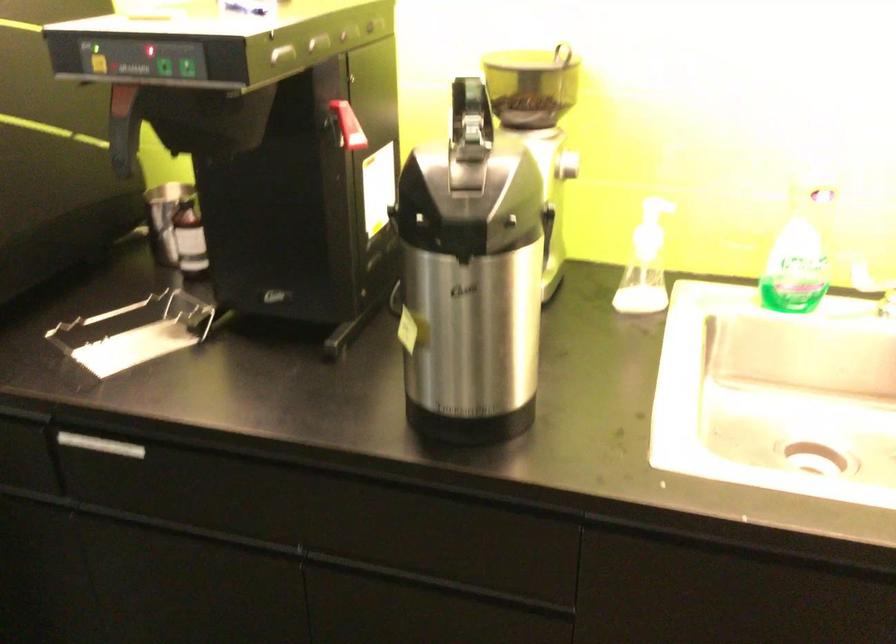
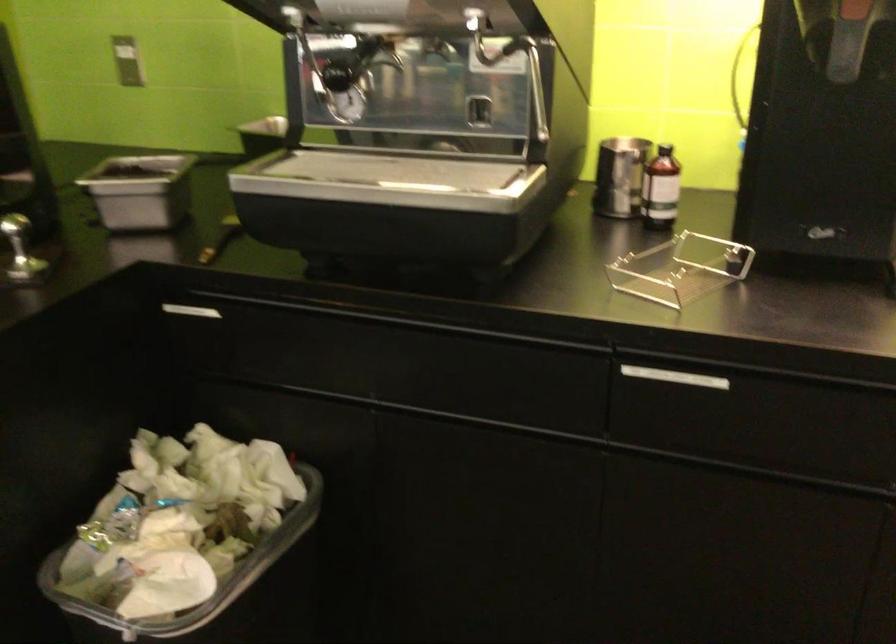
Question: What movement of the cameraman would produce the second image?

Choices:
 (A) Left
 (B) Right
 (C) Forward
 (D) Backward

Answer: (A)